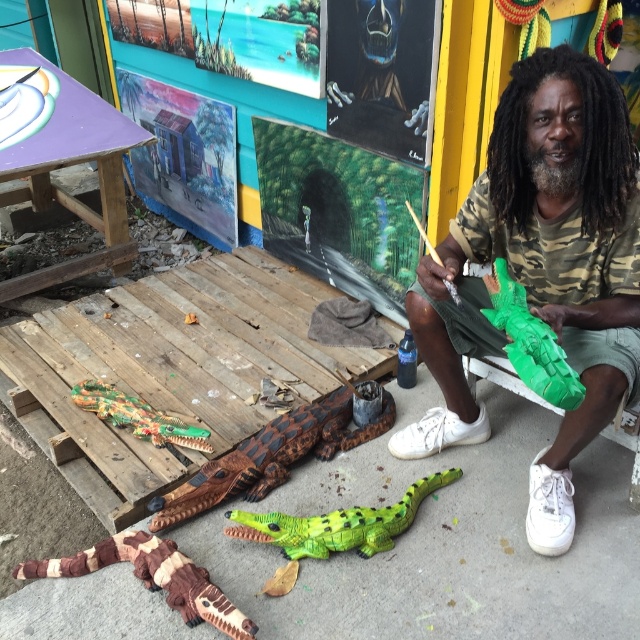
Between point (125, 541) and point (305, 532), which one is positioned in front?

Positioned in front is point (125, 541).

Is point (163, 584) farther from camera compared to point (385, 531)?

No, it is not.

Is point (16, 570) farther from viewer compared to point (268, 515)?

No, it is in front of (268, 515).

The image size is (640, 640). What are the coordinates of `brown textured crocodile at lower left` in the screenshot? It's located at (152, 577).

Is the position of green plastic lizard at lower center less distant than that of green matte plastic crocodile at center?

No, green plastic lizard at lower center is further to the viewer.

Is green plastic lizard at lower center below green matte plastic crocodile at center?

Correct, green plastic lizard at lower center is located below green matte plastic crocodile at center.

Is point (376, 515) more distant than point (541, 387)?

Yes, it is.

I want to click on green plastic lizard at lower center, so click(337, 524).

Who is positioned more to the left, green matte crocodile at center or green matte plastic crocodile at center?

green matte plastic crocodile at center

Does green matte crocodile at center have a greater width compared to green matte plastic crocodile at center?

Yes.

Who is more distant from viewer, (563, 481) or (544, 371)?

The point (563, 481) is behind.

This screenshot has width=640, height=640. Find the location of `green matte crocodile at center`. green matte crocodile at center is located at coordinates (541, 268).